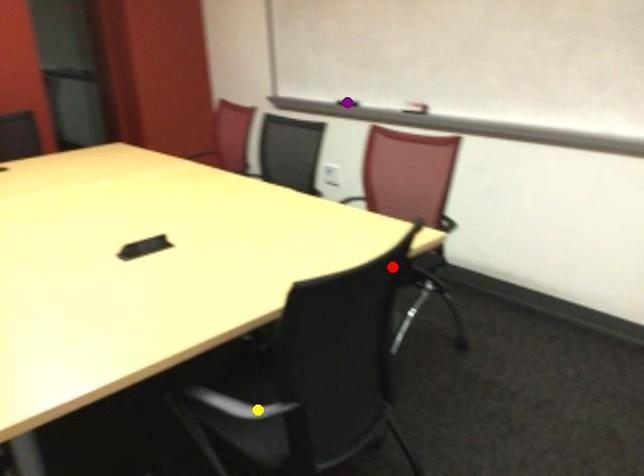
From the picture: Order these from nearest to farthest:
A) yellow point
B) red point
C) purple point

purple point, yellow point, red point